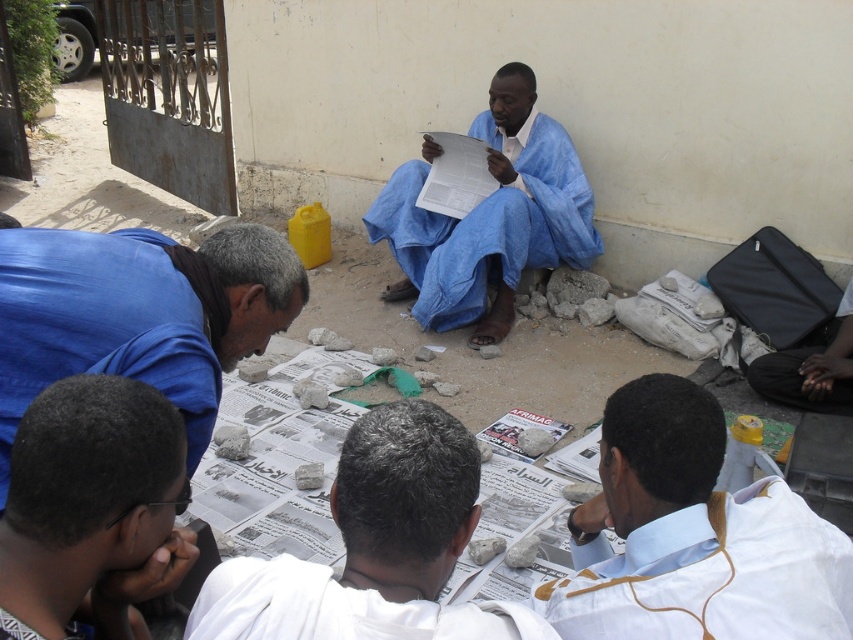
Question: Does white cotton shirt at lower right have a smaller size compared to blue fabric robe at lower left?

Choices:
 (A) no
 (B) yes

Answer: (A)

Question: Based on their relative distances, which object is nearer to the dark blue fabric bag at lower right?

Choices:
 (A) dark brown hair at lower left
 (B) blue fabric robe at lower left

Answer: (B)

Question: Does white cloth at center appear on the right side of dark brown hair at lower left?

Choices:
 (A) yes
 (B) no

Answer: (A)

Question: Which object appears farthest from the camera in this image?

Choices:
 (A) blue fabric robe at center
 (B) blue fabric robe at lower left
 (C) dark blue fabric bag at lower right
 (D) white cotton shirt at lower right

Answer: (A)

Question: Which of the following is the closest to the observer?

Choices:
 (A) (782, 387)
 (B) (15, 490)
 (C) (515, 205)

Answer: (B)

Question: Where is blue fabric robe at lower left located in relation to dark blue fabric bag at lower right in the image?

Choices:
 (A) left
 (B) right

Answer: (A)